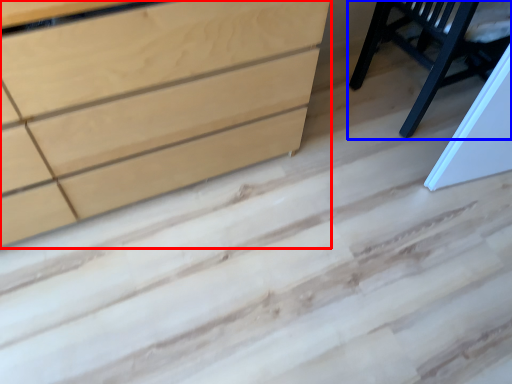
Question: Which point is closer to the camera, chest of drawers (highlighted by a red box) or furniture (highlighted by a blue box)?

Choices:
 (A) chest of drawers
 (B) furniture

Answer: (A)